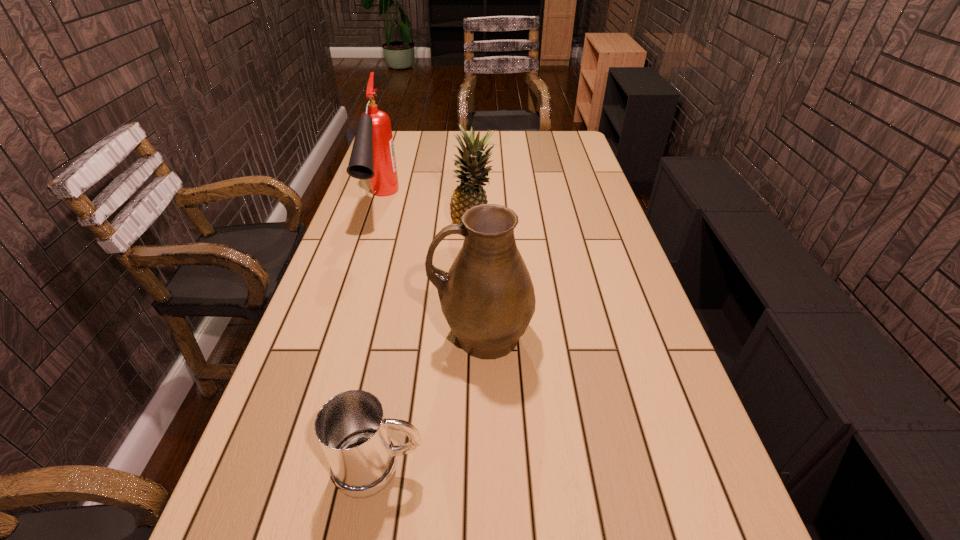
In order to click on free region located on the side of the mug with the handle in this screenshot , I will do click(588, 467).

This screenshot has width=960, height=540. I want to click on object positioned at the left edge, so click(372, 157).

Where is `free spot at the far edge of the desktop`? The width and height of the screenshot is (960, 540). free spot at the far edge of the desktop is located at coordinates (419, 149).

In order to click on free space at the left edge in this screenshot , I will do `click(313, 442)`.

At what (x,y) coordinates should I click in order to perform the action: click on vacant space at the right edge of the desktop. Please return your answer as a coordinate pair (x, y). The width and height of the screenshot is (960, 540). Looking at the image, I should click on (588, 181).

The width and height of the screenshot is (960, 540). In the image, there is a desktop. What are the coordinates of `vacant space at the far left corner` in the screenshot? It's located at (404, 148).

Locate an element on the screen. Image resolution: width=960 pixels, height=540 pixels. vacant area that lies between the nearest object and the fire extinguisher is located at coordinates (380, 335).

You are a GUI agent. You are given a task and a screenshot of the screen. Output one action in this format:
    pyautogui.click(x=<x>, y=<y>)
    Task: Click on the vacant area that lies between the nearest object and the fire extinguisher
    
    Given the screenshot: What is the action you would take?
    pyautogui.click(x=380, y=335)

This screenshot has height=540, width=960. I want to click on vacant area that lies between the pineapple and the fire extinguisher, so click(427, 215).

Where is `vacant space that is in between the pineapple and the shortest object`? Image resolution: width=960 pixels, height=540 pixels. vacant space that is in between the pineapple and the shortest object is located at coordinates (426, 347).